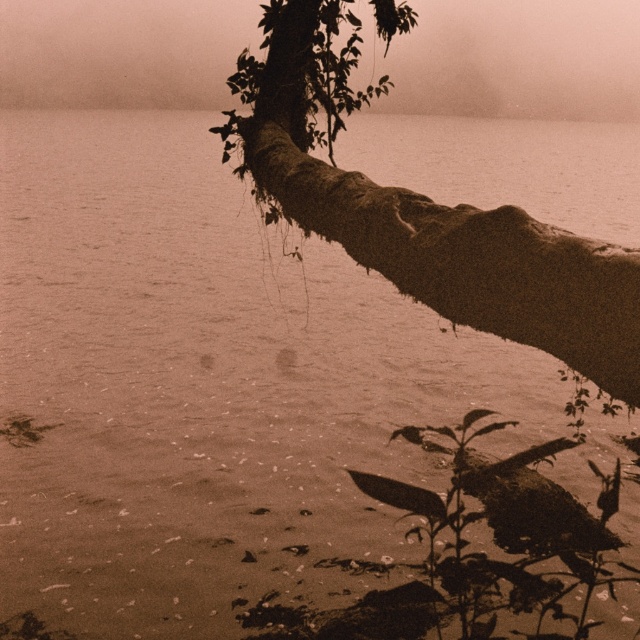
You are a bird looking for a place to perch. You see the rough bark branch at upper right. Can you determine its exact location in the image?

The rough bark branch at upper right is located at point (422, 211).

You are an observer looking at the scene. You notice the rough bark branch at upper right and the foggy mist at upper center. Which object is positioned nearer to your viewpoint?

The rough bark branch at upper right is closer to the viewer than the foggy mist at upper center.